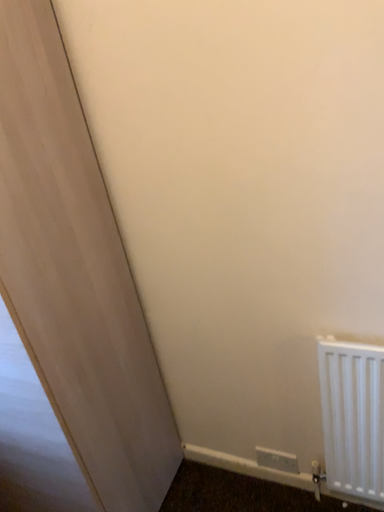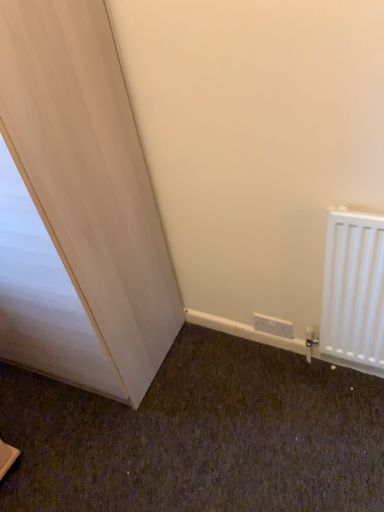
Question: Which way did the camera rotate in the video?

Choices:
 (A) rotated downward
 (B) rotated upward

Answer: (A)